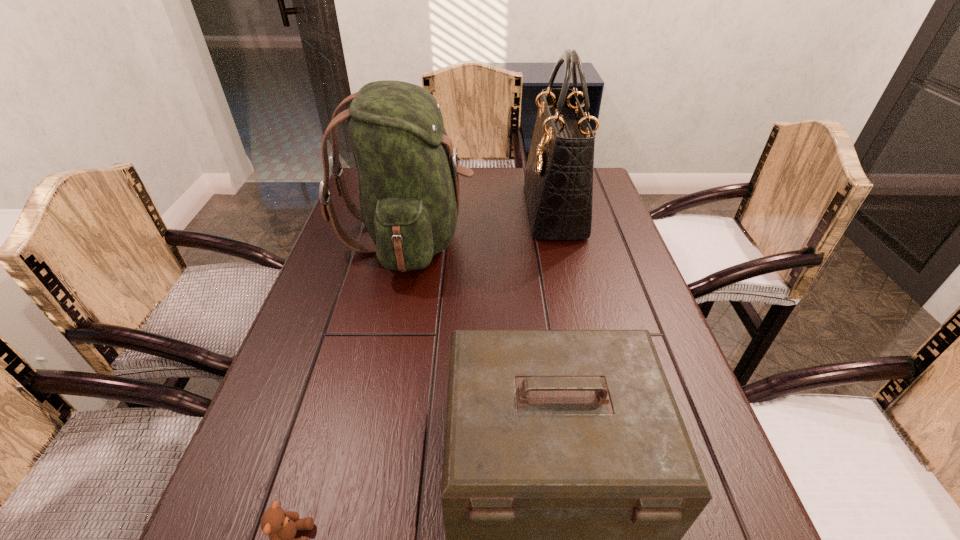
The height and width of the screenshot is (540, 960). What are the coordinates of `object present at the far left corner` in the screenshot? It's located at (408, 172).

You are a GUI agent. You are given a task and a screenshot of the screen. Output one action in this format:
    pyautogui.click(x=<x>, y=<y>)
    Task: Click on the object located at the far right corner
    
    Given the screenshot: What is the action you would take?
    pyautogui.click(x=558, y=179)

Locate an element on the screen. The height and width of the screenshot is (540, 960). vacant space at the left edge is located at coordinates (318, 330).

At what (x,y) coordinates should I click in order to perform the action: click on free region at the right edge of the desktop. Please return your answer as a coordinate pair (x, y). Looking at the image, I should click on (592, 233).

In the image, there is a desktop. Identify the location of vacant region at the far right corner. Image resolution: width=960 pixels, height=540 pixels. (604, 184).

Where is `free space between the handbag and the backpack`? The image size is (960, 540). free space between the handbag and the backpack is located at coordinates (481, 223).

This screenshot has width=960, height=540. I want to click on free space between the handbag and the backpack, so click(481, 223).

Image resolution: width=960 pixels, height=540 pixels. In order to click on object that is the third closest one to the teddy bear in this screenshot , I will do `click(558, 179)`.

In order to click on object that is the second closest to the third tallest object in this screenshot , I will do `click(408, 172)`.